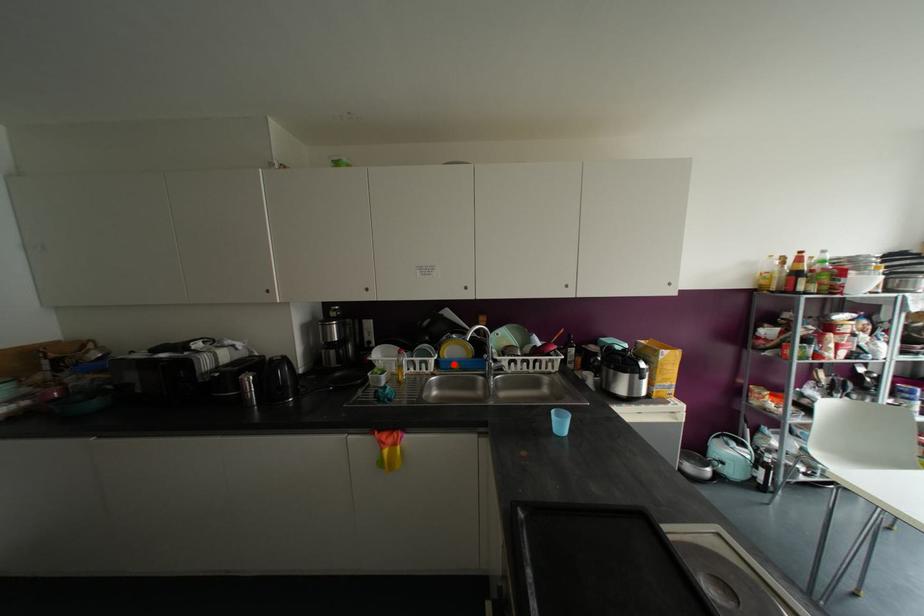
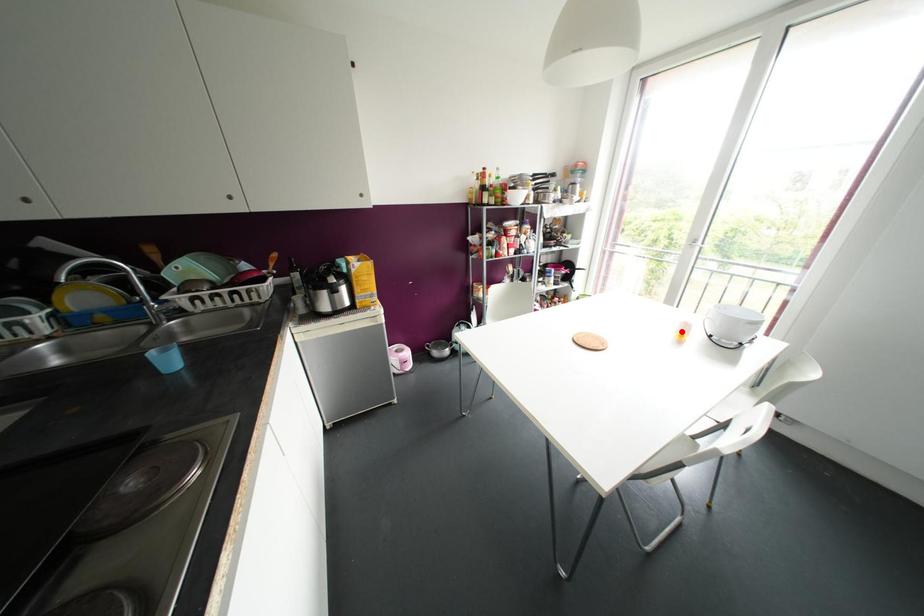
I am providing you with two images of the same scene from different viewpoints. A red point is marked on the first image and another point is marked on the second image. Is the marked point in image1 the same physical position as the marked point in image2?

No